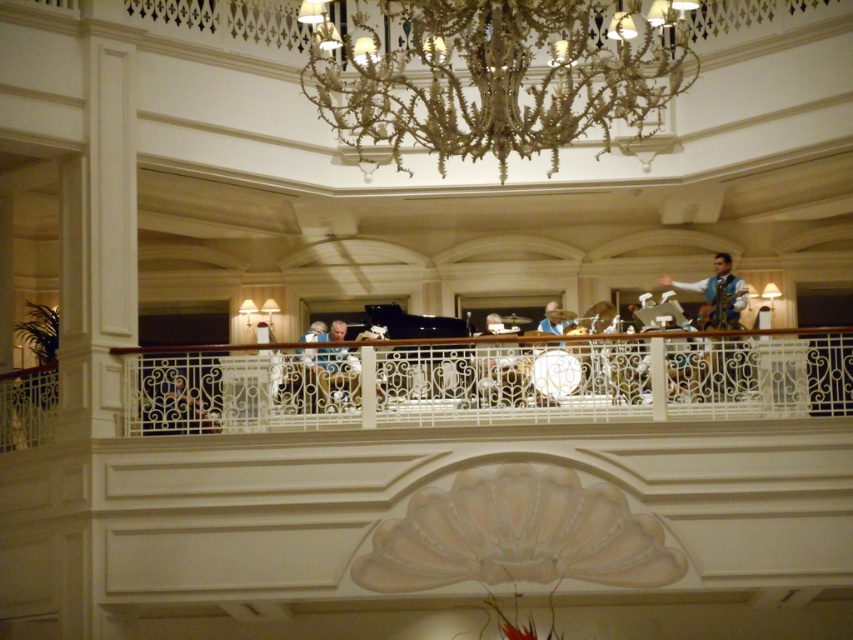
You are a stagehand carrying a 4 meter ladder. You need to move it from the light blue fabric at upper right to the light brown wooden chair at center. Can you move it horizontally without tilting the ladder?

The distance between the light blue fabric at upper right and the light brown wooden chair at center is 47.54 meters. Since the ladder is only 4 meters long, you can move it horizontally without tilting as the distance is much larger than the ladder.

You are standing in the grand hotel venue and want to move to the point marked at coordinates (525, 352). Given that you can walk 100 meters in 2 minutes, how long would it take you to reach that point?

The point at coordinates (525, 352) is 68.06 meters away from the viewer. At a walking speed of 100 meters per 2 minutes, it would take approximately 1.36 minutes, which is roughly 82 seconds, to reach the point.

You are a stagehand preparing to hang a banner that requires a support at least 2 meters tall. You see the white wrought iron railing at upper center and the light blue fabric at upper right. Which object can provide sufficient height for your banner?

The light blue fabric at upper right is taller than the white wrought iron railing at upper center, so it can provide sufficient height for the banner.